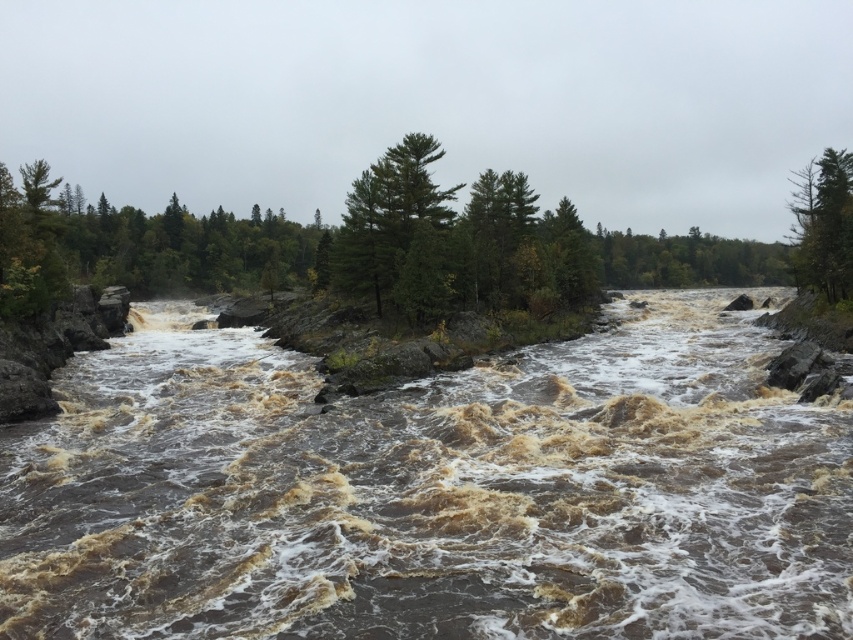
Question: Which of the following is the closest to the observer?

Choices:
 (A) (566, 432)
 (B) (361, 272)

Answer: (A)

Question: Does brown muddy water at center appear over green matte tree at left?

Choices:
 (A) yes
 (B) no

Answer: (B)

Question: Among these objects, which one is farthest from the camera?

Choices:
 (A) green matte tree at upper right
 (B) brown muddy water at center
 (C) green matte tree at center
 (D) green matte tree at left

Answer: (A)

Question: Is green matte tree at center bigger than green matte tree at upper right?

Choices:
 (A) yes
 (B) no

Answer: (B)

Question: Is green matte tree at left below green leafy trees at center?

Choices:
 (A) yes
 (B) no

Answer: (A)

Question: Which of the following is the farthest from the observer?

Choices:
 (A) green leafy trees at center
 (B) brown muddy water at center
 (C) green matte tree at left
 (D) green matte tree at upper right

Answer: (A)